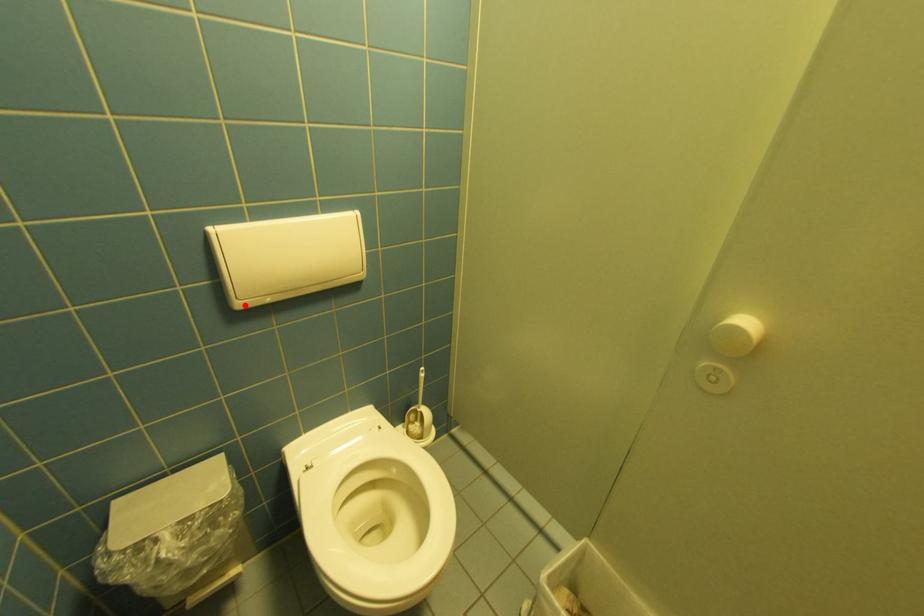
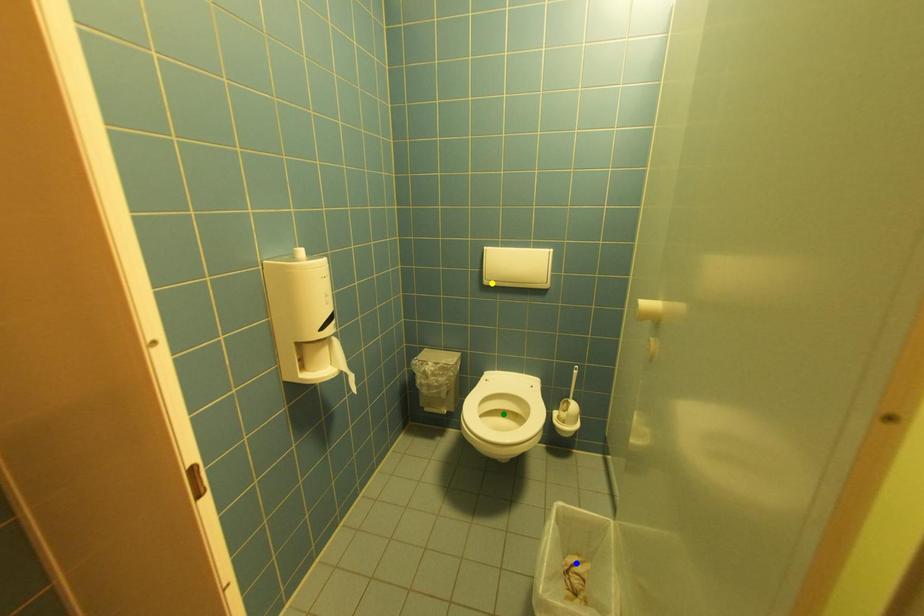
Question: I am providing you with two images of the same scene from different viewpoints. A red point is marked on the first image. You are given multiple points on the second image. In image 2, which mark is for the same physical point as the one in image 1?

Choices:
 (A) blue point
 (B) yellow point
 (C) green point

Answer: (B)